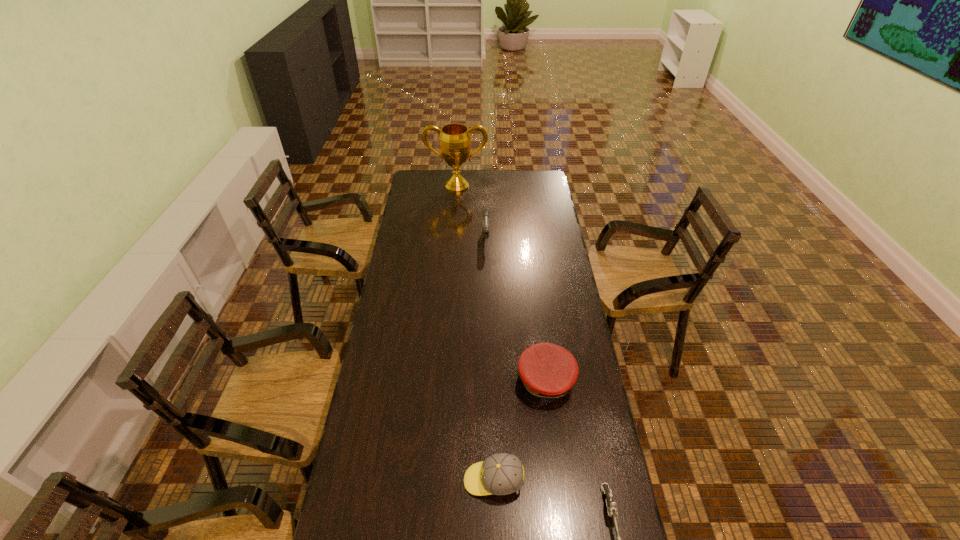
You are a GUI agent. You are given a task and a screenshot of the screen. Output one action in this format:
    pyautogui.click(x=<x>, y=<y>)
    Task: Click on the free location located on the front-facing side of the baseball cap
    
    Given the screenshot: What is the action you would take?
    pyautogui.click(x=431, y=481)

At what (x,y) coordinates should I click in order to perform the action: click on vacant area situated 0.110m on the front-facing side of the baseball cap. Please return your answer as a coordinate pair (x, y). Looking at the image, I should click on (427, 481).

Identify the location of object at the far edge. (455, 143).

In order to click on object at the left edge in this screenshot , I will do click(x=455, y=143).

Locate an element on the screen. This screenshot has height=540, width=960. object at the right edge is located at coordinates (547, 371).

Identify the location of object positioned at the far left corner. The height and width of the screenshot is (540, 960). (455, 143).

Find the location of a particular element. vacant space at the far edge of the desktop is located at coordinates (500, 183).

In the image, there is a desktop. Where is `vacant space at the left edge`? This screenshot has width=960, height=540. vacant space at the left edge is located at coordinates (412, 212).

Where is `vacant space at the right edge of the desktop`? vacant space at the right edge of the desktop is located at coordinates (553, 284).

Find the location of a particular element. The height and width of the screenshot is (540, 960). free space at the far right corner of the desktop is located at coordinates (529, 185).